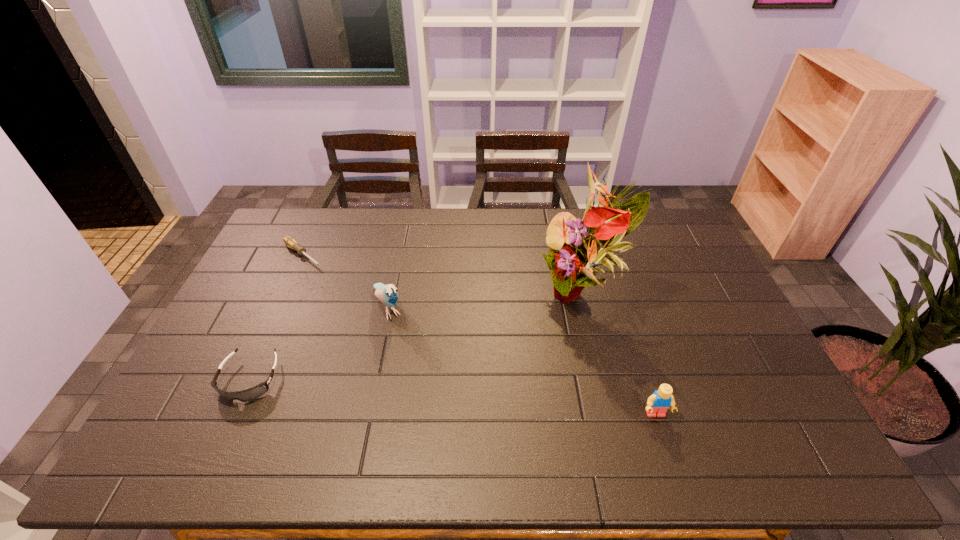
This screenshot has width=960, height=540. I want to click on vacant space located on the front-facing side of the bouquet, so pos(520,362).

This screenshot has width=960, height=540. What are the coordinates of `free space located at the face of the bird` in the screenshot? It's located at (416, 371).

Find the location of a particular element. This screenshot has width=960, height=540. vacant space located 0.300m at the face of the bird is located at coordinates (436, 409).

Where is `free location located 0.330m at the face of the bird`? free location located 0.330m at the face of the bird is located at coordinates (442, 418).

Where is `free region located 0.290m at the tip of the screwdriver`? The width and height of the screenshot is (960, 540). free region located 0.290m at the tip of the screwdriver is located at coordinates (369, 307).

You are a GUI agent. You are given a task and a screenshot of the screen. Output one action in this format:
    pyautogui.click(x=<x>, y=<y>)
    Task: Click on the vacant space situated 0.350m at the tip of the screwdriver
    
    Given the screenshot: What is the action you would take?
    tap(381, 316)

You are a GUI agent. You are given a task and a screenshot of the screen. Output one action in this format:
    pyautogui.click(x=<x>, y=<y>)
    Task: Click on the blank area located at the tip of the screwdriver
    
    Given the screenshot: What is the action you would take?
    pyautogui.click(x=377, y=313)

This screenshot has width=960, height=540. Find the location of `object at the far edge`. object at the far edge is located at coordinates (290, 242).

Where is `goggles that is at the near edge`? The height and width of the screenshot is (540, 960). goggles that is at the near edge is located at coordinates (255, 392).

You are a GUI agent. You are given a task and a screenshot of the screen. Output one action in this format:
    pyautogui.click(x=<x>, y=<y>)
    Task: Click on the Lego that is at the near edge
    This screenshot has width=960, height=540.
    Given the screenshot: What is the action you would take?
    pyautogui.click(x=658, y=403)